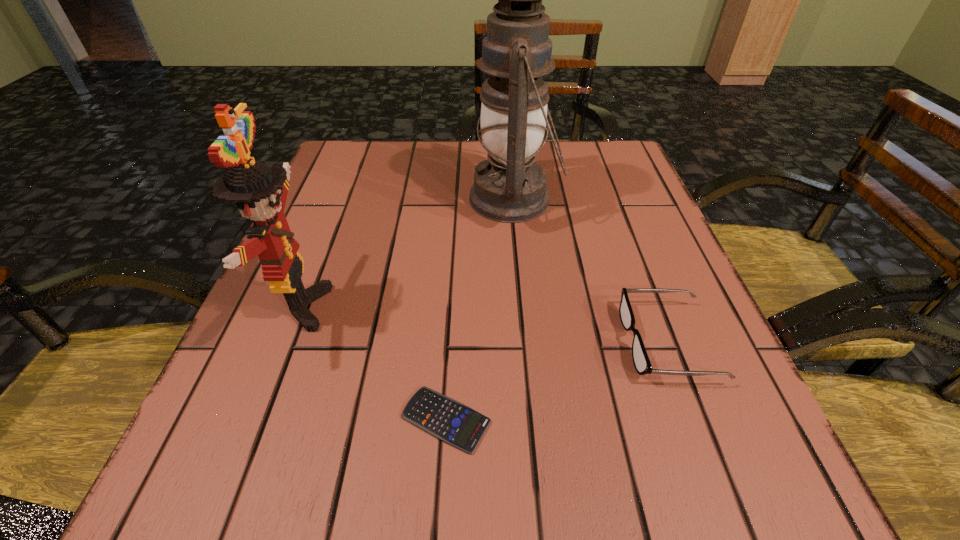
You are a GUI agent. You are given a task and a screenshot of the screen. Output one action in this format:
    pyautogui.click(x=<x>, y=<y>)
    Task: Click on the free space located 0.060m on the front-facing side of the rightmost object
    The height and width of the screenshot is (540, 960).
    Given the screenshot: What is the action you would take?
    pyautogui.click(x=588, y=342)

Where is `vacant space situated 0.130m on the front-facing side of the rightmost object`? vacant space situated 0.130m on the front-facing side of the rightmost object is located at coordinates (542, 342).

Where is `vacant region located 0.340m on the front-facing side of the rightmost object`? vacant region located 0.340m on the front-facing side of the rightmost object is located at coordinates (408, 342).

You are a GUI agent. You are given a task and a screenshot of the screen. Output one action in this format:
    pyautogui.click(x=<x>, y=<y>)
    Task: Click on the vacant space located on the right of the shortest object
    This screenshot has height=540, width=960.
    Given the screenshot: What is the action you would take?
    pyautogui.click(x=564, y=420)

Where is `object present at the far edge`? object present at the far edge is located at coordinates (510, 187).

Where is `object present at the near edge`? object present at the near edge is located at coordinates (443, 417).

Where is `object that is positioned at the left edge`? object that is positioned at the left edge is located at coordinates (260, 190).

Locate an element on the screen. object situated at the right edge is located at coordinates tap(641, 361).

The image size is (960, 540). What are the coordinates of `free region at the far edge of the desktop` in the screenshot? It's located at (413, 154).

You are a GUI agent. You are given a task and a screenshot of the screen. Output one action in this format:
    pyautogui.click(x=<x>, y=<y>)
    Task: Click on the free space at the near edge
    
    Given the screenshot: What is the action you would take?
    pyautogui.click(x=631, y=485)